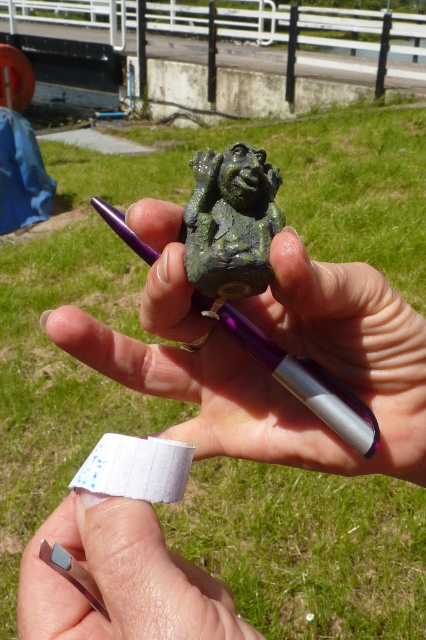
In the scene shown: You are an artist trying to sketch the scene in front of you. You want to draw the green patina stone statue at center and the purple metallic pen at center first. According to the spatial arrangement, which object should you draw first to maintain the correct left to right order?

The green patina stone statue at center should be drawn first since it is positioned to the left of the purple metallic pen at center, ensuring the left to right order is maintained.

You are an artist trying to sketch the scene. You notice two points in the image at coordinates point (135, 250) and point (135, 476). Which point is closer to the viewer?

Point (135, 476) is closer to the viewer because it is in front of point (135, 250).

What is the object located at the coordinates point [120,579] in the image?

The object at point [120,579] is nail polish.